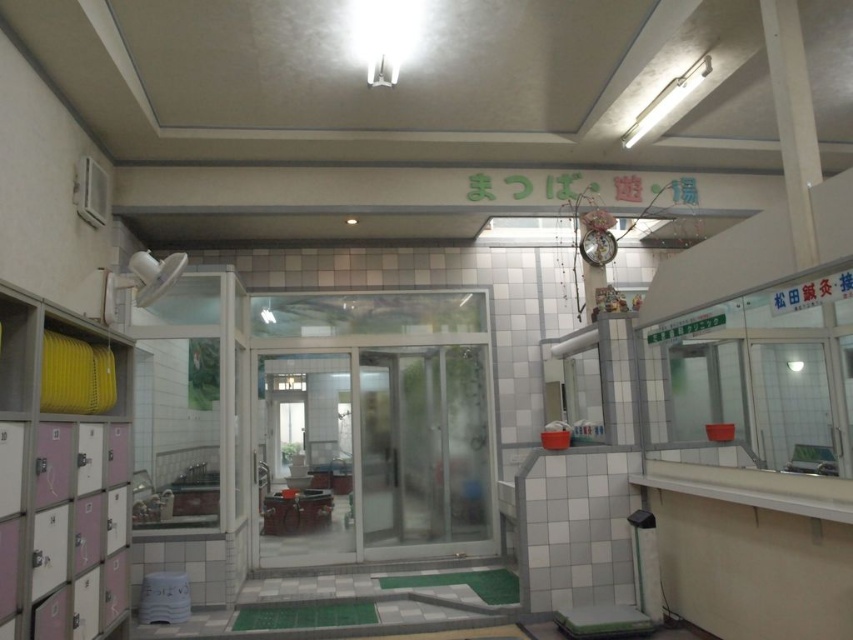
You are a guest at the bathhouse and need to store your belongings. You have a large backpack that is 1 meter in width. The pink matte locker at left and the transparent plastic screen door at center are both potential storage options. Which one can accommodate your backpack?

The transparent plastic screen door at center is larger than the pink matte locker at left. Since your backpack is 1 meter wide, the transparent plastic screen door at center is the better option as it can accommodate the backpack.

You are standing at the entrance of the bathhouse and see a point marked at coordinate (61,474). Which object in the scene does this point belong to?

The point at coordinate (61,474) belongs to the pink matte locker at left.